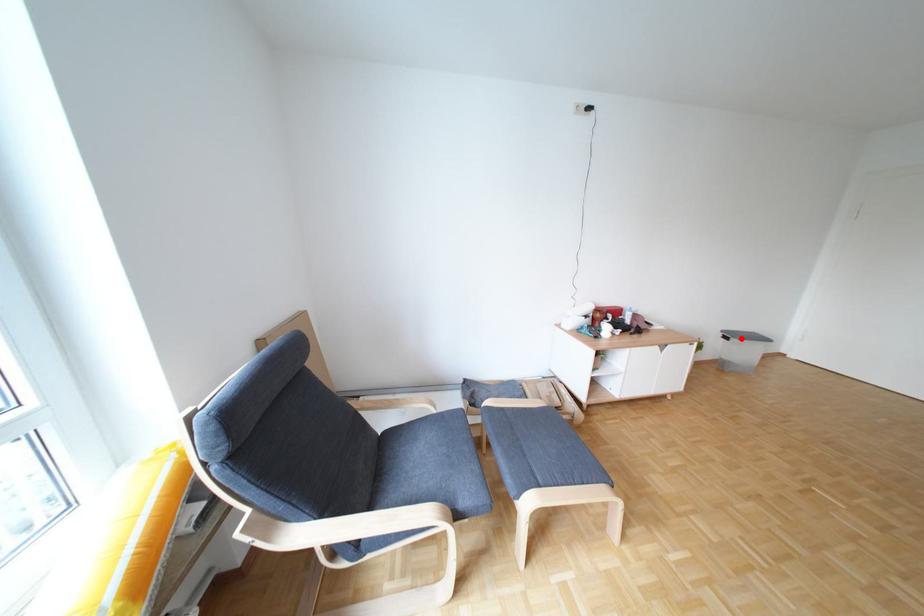
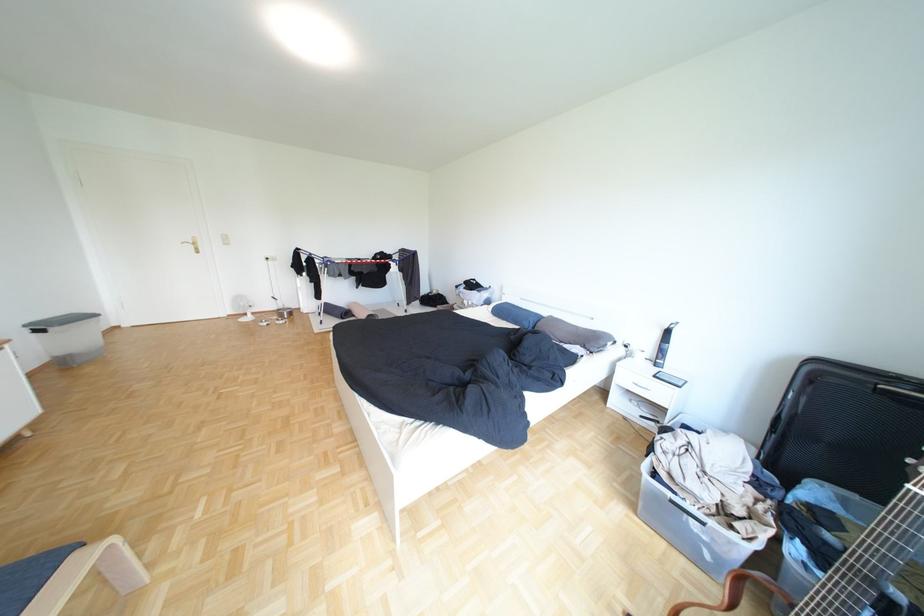
Question: I am providing you with two images of the same scene from different viewpoints. A red point is marked on the first image. Can you still see the location of the red point in image 2?

Choices:
 (A) Yes
 (B) No

Answer: (A)